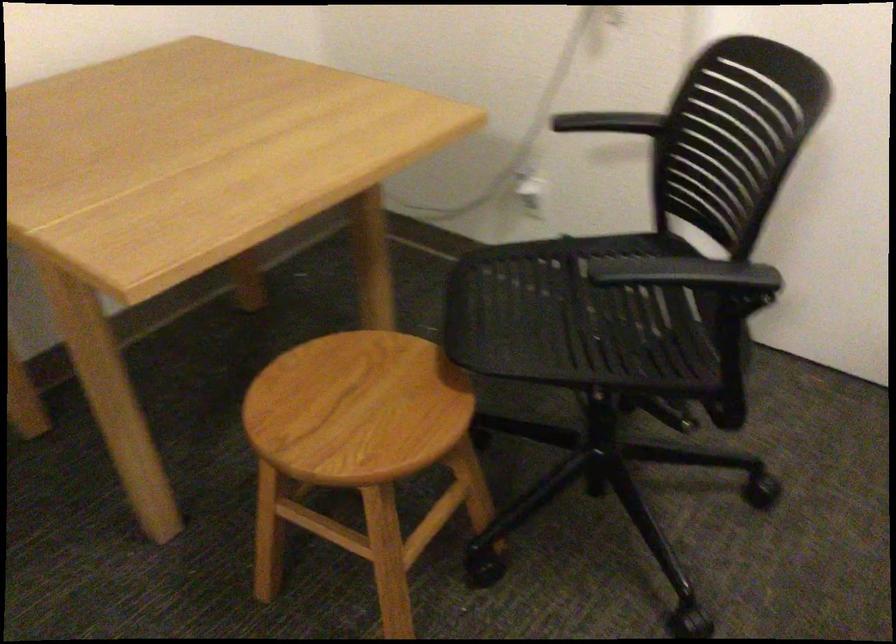
This screenshot has width=896, height=644. Identify the location of wooden chair sitting surface. (356, 408).